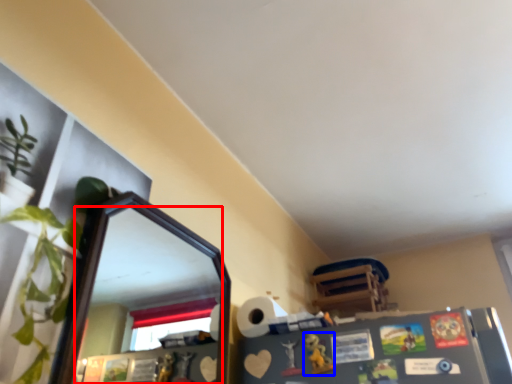
Question: Which of the following is the closest to the observer, mirror (highlighted by a red box) or toy (highlighted by a blue box)?

Choices:
 (A) mirror
 (B) toy

Answer: (A)